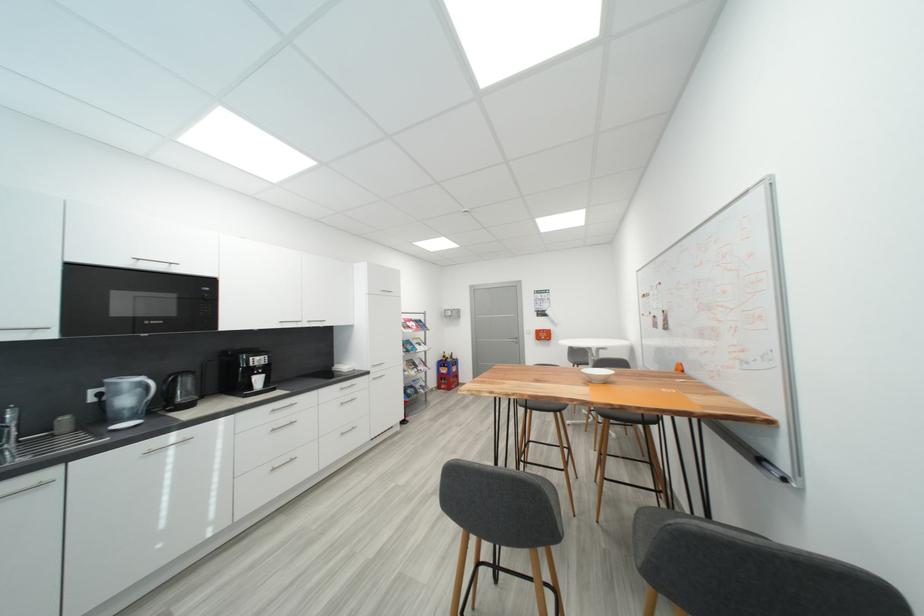
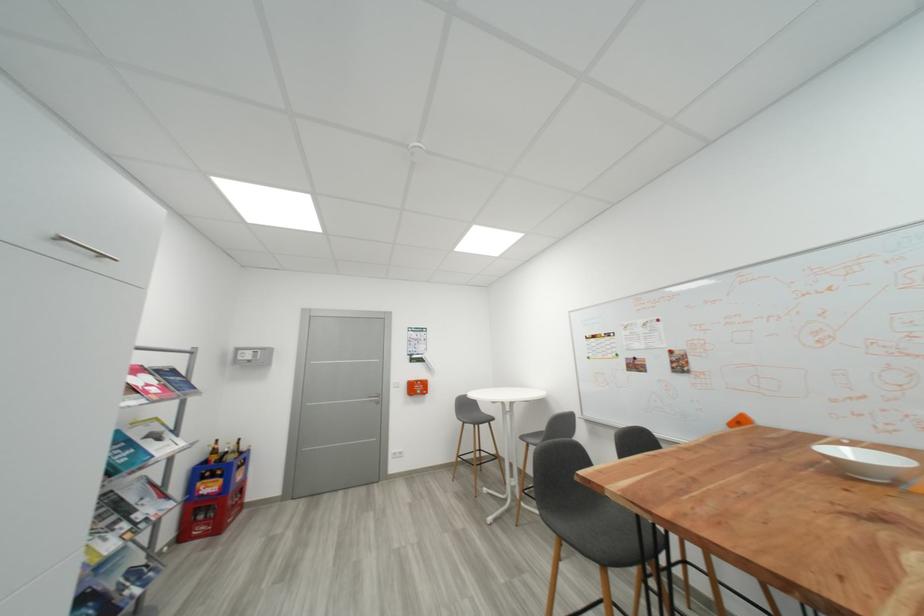
The point at (452, 359) is marked in the first image. Where is the corresponding point in the second image?

(223, 454)